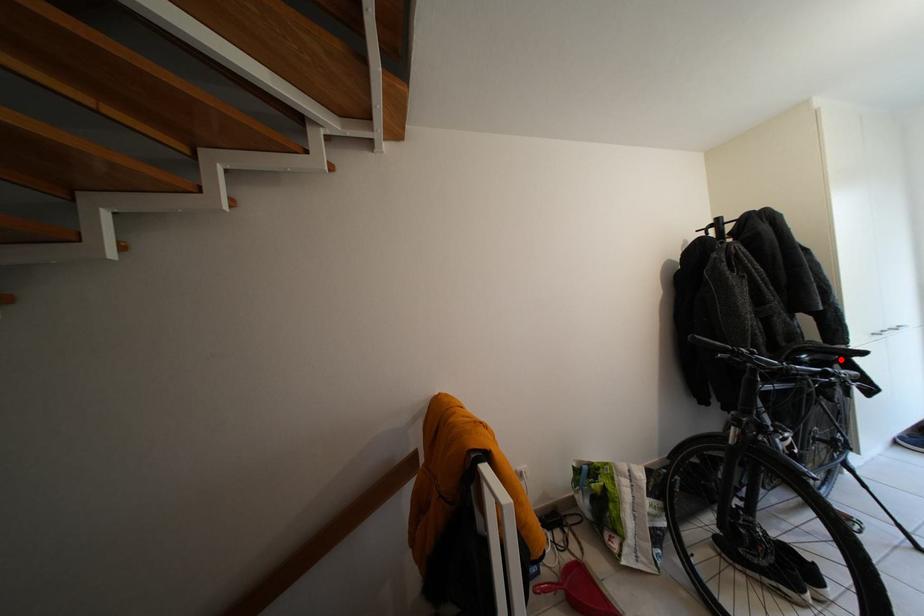
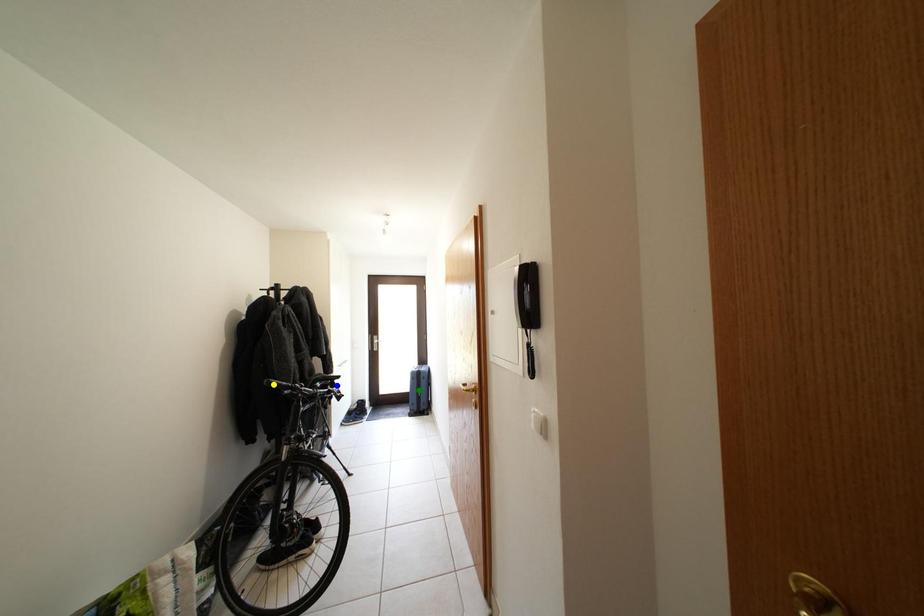
Question: I am providing you with two images of the same scene from different viewpoints. A red point is marked on the first image. You are given multiple points on the second image. Which point in image 2 represents the same 3d spot as the red point in image 1?

Choices:
 (A) blue point
 (B) yellow point
 (C) green point

Answer: (A)